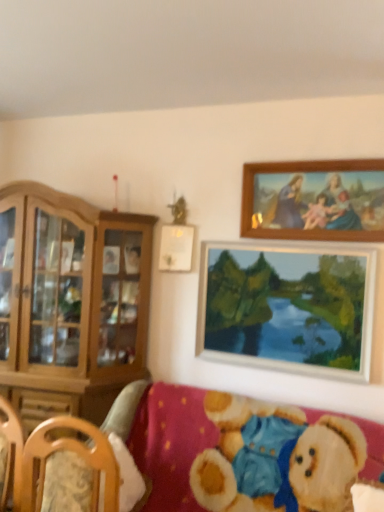
This screenshot has height=512, width=384. Find the location of `empty space that is ontop of wooden frame painting at upper right, arranged as the third picture frame when viewed from the top (from a real-world perspective)`. empty space that is ontop of wooden frame painting at upper right, arranged as the third picture frame when viewed from the top (from a real-world perspective) is located at coordinates (295, 238).